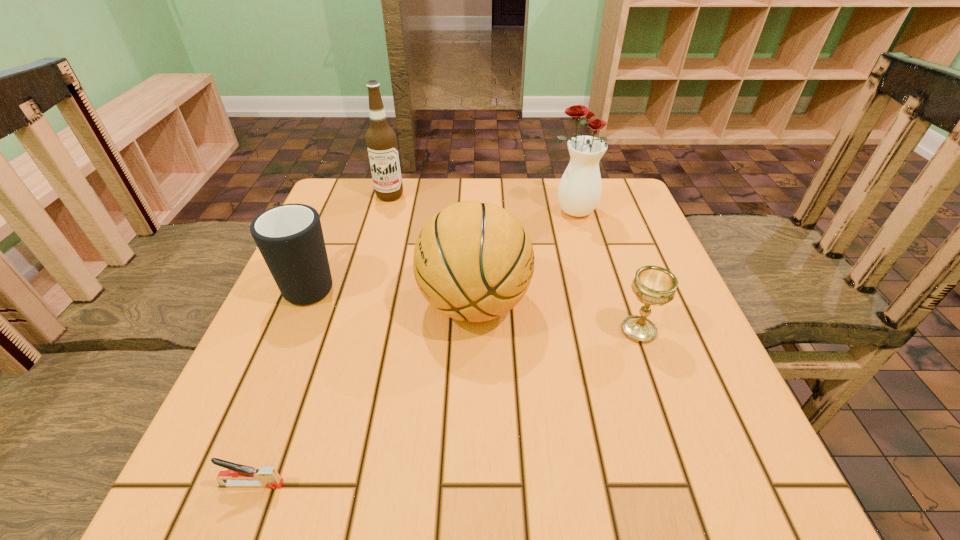
Find the location of a particular element. This screenshot has width=960, height=540. vacant point located on the surface of the basketball near the brand logo is located at coordinates point(629,304).

This screenshot has width=960, height=540. What are the coordinates of `vacant point located 0.130m on the side of the fourth tallest object with the handle` in the screenshot? It's located at (337, 222).

Where is `free space located 0.310m on the side of the fourth tallest object with the handle`? The image size is (960, 540). free space located 0.310m on the side of the fourth tallest object with the handle is located at coordinates (352, 186).

Identify the location of vacant region located 0.260m on the side of the fourth tallest object with the handle. This screenshot has width=960, height=540. [348, 195].

Image resolution: width=960 pixels, height=540 pixels. Identify the location of vacant space located on the back of the chalice. (621, 282).

Where is `vacant space situated 0.210m on the handle side of the nearest object`? This screenshot has width=960, height=540. vacant space situated 0.210m on the handle side of the nearest object is located at coordinates (431, 484).

What are the coordinates of `alcohol that is at the far edge` in the screenshot? It's located at (381, 140).

This screenshot has height=540, width=960. What are the coordinates of `vase situated at the far edge` in the screenshot? It's located at (579, 192).

You are a GUI agent. You are given a task and a screenshot of the screen. Output one action in this format:
    pyautogui.click(x=<x>, y=<y>)
    Task: Click on the object positioned at the near edge
    The width and height of the screenshot is (960, 540).
    Given the screenshot: What is the action you would take?
    pyautogui.click(x=238, y=475)

Identify the location of alcohol that is at the left edge. This screenshot has height=540, width=960. (381, 140).